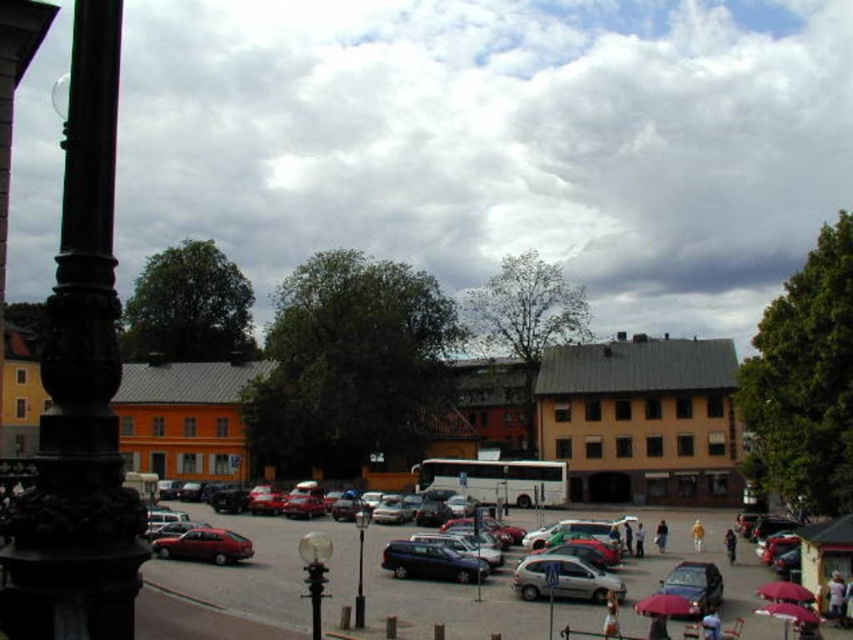
You are standing in the urban square and want to locate the point at coordinates (x=79, y=388). According to the scene, where exactly would you find this point?

The point at coordinates (x=79, y=388) is located on the black ornate pole at left.

You are a delivery driver who needs to park your vehicle in the urban square. The parking spot you want is at coordinates point 0.8, 0.5. Is the shiny dark blue sedan at center blocking your desired parking spot?

The shiny dark blue sedan at center is located at point (431,561), which is very close to your desired parking spot at (426,512). Since the sedan is parked near those coordinates, it is likely blocking your parking spot.

Looking at this image, you are a delivery person trying to park your vehicle in the urban square. You see the shiny dark blue sedan at center and the black polished lamp post at center. Which object is closer to you, and can you safely maneuver around it to park?

The shiny dark blue sedan at center is closer to you than the black polished lamp post at center. Since the sedan is closer, you can safely maneuver around it to park, but ensure there is enough space between the sedan and the lamp post to avoid collision.